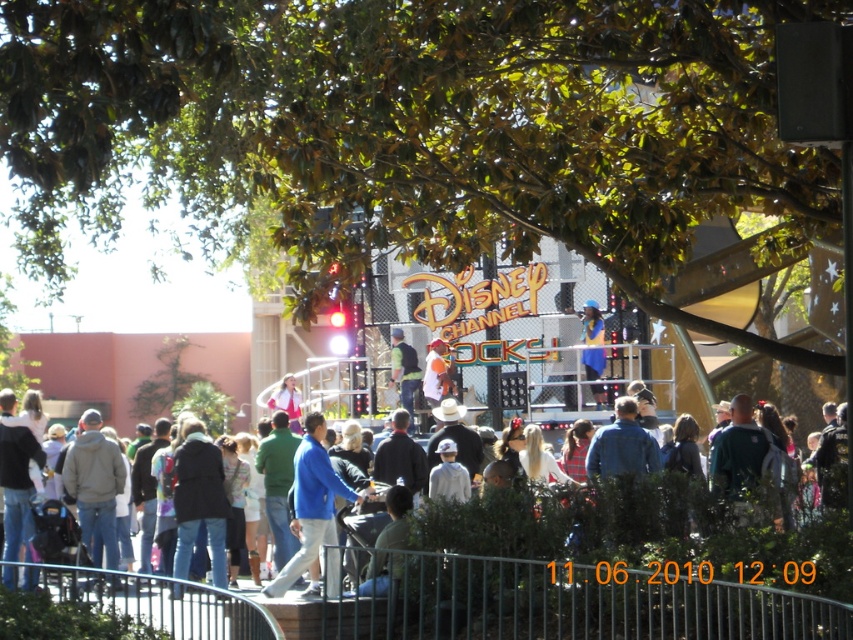
Question: Which of these objects is positioned farthest from the green fabric jacket at center?

Choices:
 (A) jeans at center
 (B) blue fabric jacket at center

Answer: (A)

Question: Does jeans at center have a lesser width compared to blue fabric jacket at center?

Choices:
 (A) yes
 (B) no

Answer: (B)

Question: Among these points, which one is farthest from the camera?

Choices:
 (A) (419, 374)
 (B) (294, 556)
 (C) (413, 518)

Answer: (A)

Question: Where is jeans at center located in relation to green fabric jacket at center in the image?

Choices:
 (A) below
 (B) above

Answer: (A)

Question: Which object appears farthest from the camera in this image?

Choices:
 (A) blue fabric jacket at center
 (B) green fabric jacket at center
 (C) jeans at center

Answer: (B)

Question: Is blue fabric jacket at center smaller than green fabric jacket at center?

Choices:
 (A) yes
 (B) no

Answer: (B)